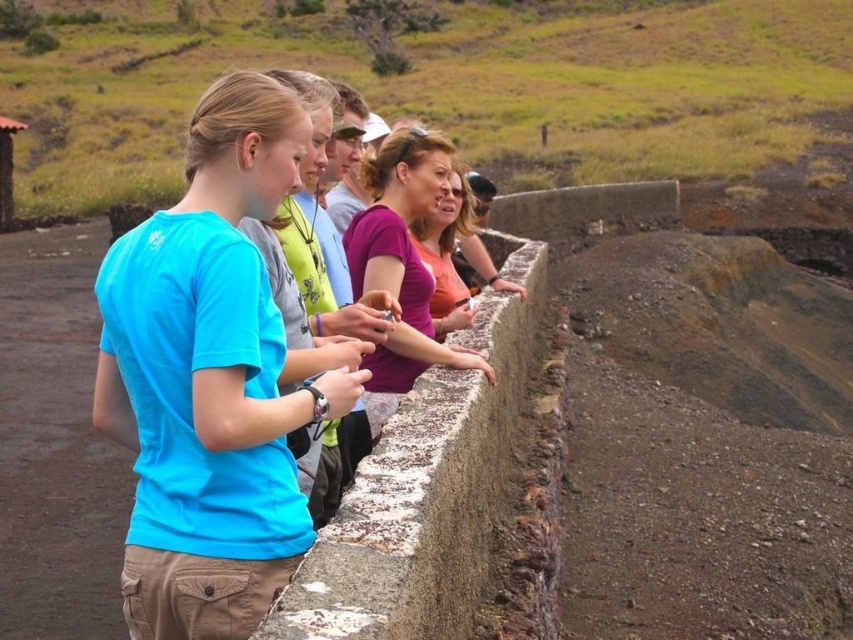
You are part of the group standing near the rusty concrete barrier at center and the matte blue shirt at center. If someone behind you wants to see what you are looking at, which object would they need to move past first?

The rusty concrete barrier at center is in front of the matte blue shirt at center, so the person would need to move past the rusty concrete barrier at center first to see what the group is looking at.

You are a tour guide leading a group near a rugged outdoor setting. You notice the rusty concrete barrier at center and the purple matte shirt at center. Which object is wider from your perspective?

The rusty concrete barrier at center is wider than the purple matte shirt at center.